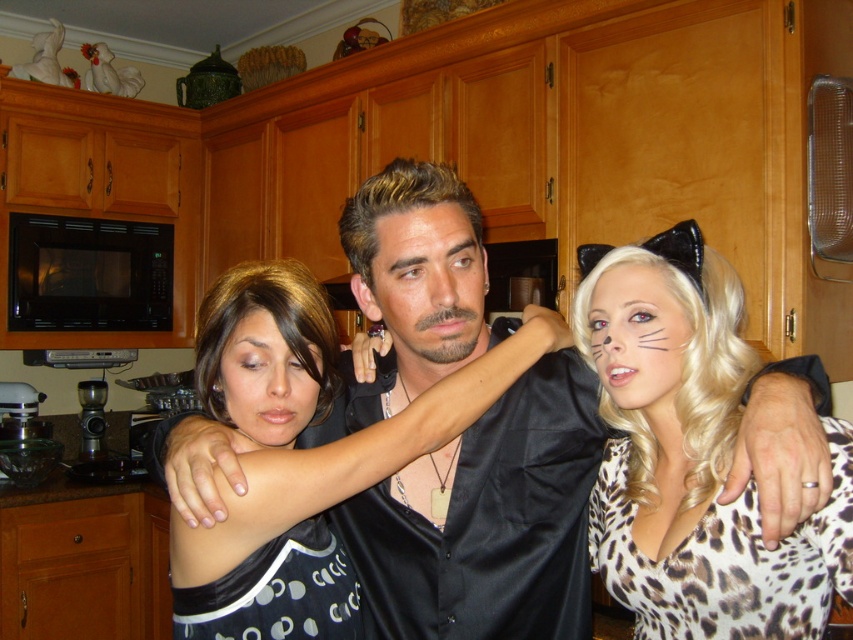
Looking at this image, you are standing in the kitchen and want to reach the leopard print fabric at center to grab a dish towel. Considering your arm can extend 30 inches, will you be able to reach it without moving closer?

The leopard print fabric at center is 30.86 inches away from the viewer. Since your arm can only extend 30 inches, you will not be able to reach it without moving closer.

What are the exact coordinates of the smooth skin face at center?

The smooth skin face at center is located at coordinates point (427, 285).